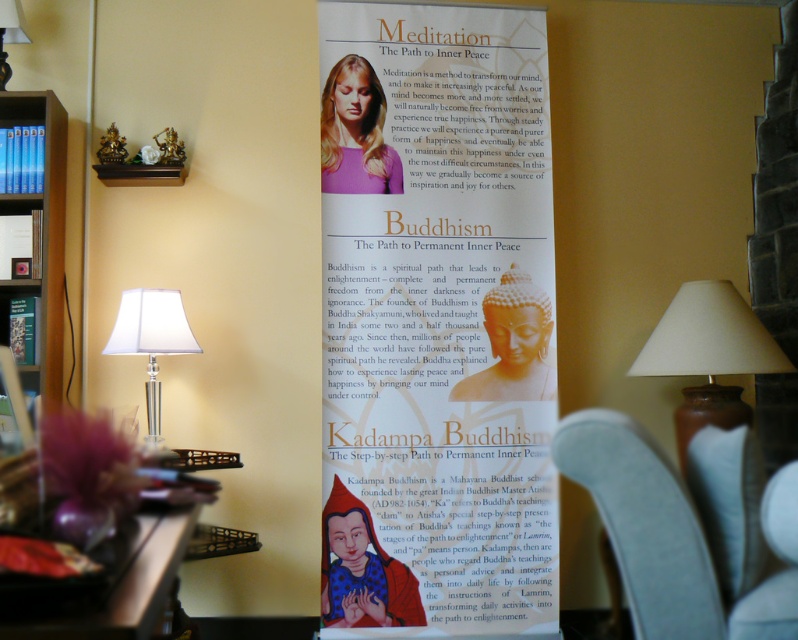
Describe the element at coordinates (125, 589) in the screenshot. This screenshot has width=798, height=640. I see `wooden table at lower left` at that location.

Identify the location of wooden table at lower left. coord(125,589).

This screenshot has height=640, width=798. In order to click on wooden table at lower left in this screenshot , I will do `click(125, 589)`.

Can you confirm if blue hardcover books at left is positioned to the right of white fabric lampshade at left?

In fact, blue hardcover books at left is to the left of white fabric lampshade at left.

Is blue hardcover books at left positioned at the back of white fabric lampshade at left?

Yes, it is.

This screenshot has height=640, width=798. What do you see at coordinates (32, 237) in the screenshot? I see `blue hardcover books at left` at bounding box center [32, 237].

What are the coordinates of `blue hardcover books at left` in the screenshot? It's located at (32, 237).

Based on the photo, does purple matte shirt at upper center have a greater height compared to matte glass lampshade at upper left?

Yes.

This screenshot has height=640, width=798. What do you see at coordinates (354, 132) in the screenshot?
I see `purple matte shirt at upper center` at bounding box center [354, 132].

Find the location of a particular element. purple matte shirt at upper center is located at coordinates (354, 132).